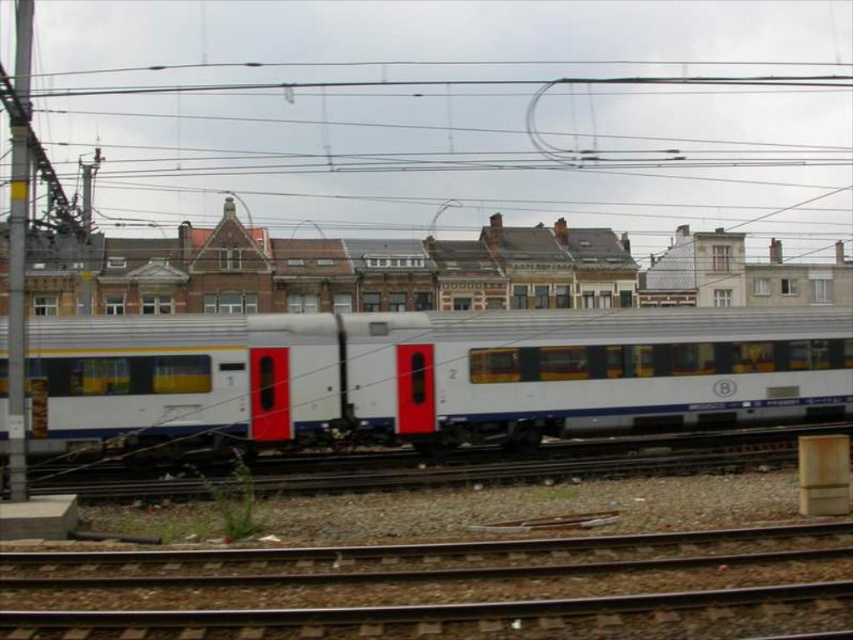
You are a maintenance worker checking the train track. You notice the white glossy train car at center and the brown gravel train track at lower center. Is the train car wider than the track?

The white glossy train car at center might be wider than brown gravel train track at lower center according to the description, so it is possible that the train car is wider than the track.

You are a passenger standing on the platform waiting for the train. You see the white glossy train car at center and the brown gravel train track at lower center. Which object is closer to you?

The white glossy train car at center is closer to you than the brown gravel train track at lower center because it is further to the viewer.